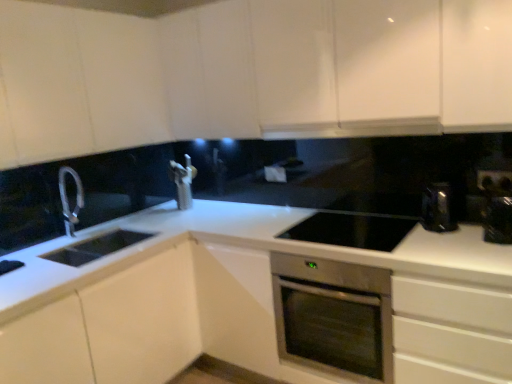
Question: From the image's perspective, does stainless steel oven at center appear lower than white glossy cabinet at upper left, arranged as the second cabinetry when ordered from the bottom?

Choices:
 (A) yes
 (B) no

Answer: (A)

Question: Can you confirm if stainless steel oven at center is positioned to the left of white glossy cabinet at upper left, arranged as the second cabinetry when ordered from the bottom?

Choices:
 (A) yes
 (B) no

Answer: (B)

Question: Does stainless steel oven at center have a greater height compared to white glossy cabinet at upper left, arranged as the second cabinetry when ordered from the bottom?

Choices:
 (A) no
 (B) yes

Answer: (A)

Question: Is stainless steel oven at center not within white glossy cabinet at upper left, arranged as the second cabinetry when ordered from the bottom?

Choices:
 (A) yes
 (B) no

Answer: (A)

Question: Is stainless steel oven at center placed right next to white glossy cabinet at upper left, arranged as the second cabinetry when ordered from the bottom?

Choices:
 (A) yes
 (B) no

Answer: (B)

Question: In terms of width, does stainless steel oven at center look wider or thinner when compared to white glossy cabinet at upper left, arranged as the second cabinetry when ordered from the bottom?

Choices:
 (A) wide
 (B) thin

Answer: (A)

Question: In the image, is stainless steel oven at center positioned in front of or behind white glossy cabinet at upper left, the 2th cabinetry in the top-to-bottom sequence?

Choices:
 (A) front
 (B) behind

Answer: (B)

Question: Is stainless steel oven at center taller or shorter than white glossy cabinet at upper left, arranged as the second cabinetry when ordered from the bottom?

Choices:
 (A) short
 (B) tall

Answer: (A)

Question: Choose the correct answer: Is stainless steel oven at center inside white glossy cabinet at upper left, arranged as the second cabinetry when ordered from the bottom, or outside it?

Choices:
 (A) outside
 (B) inside

Answer: (A)

Question: In the image, is metallic silver toaster at right, the second appliance viewed from the left, on the left side or the right side of white glossy cabinet at upper center, positioned as the 1th cabinetry in top-to-bottom order?

Choices:
 (A) right
 (B) left

Answer: (A)

Question: Is metallic silver toaster at right, the second appliance viewed from the left, in front of or behind white glossy cabinet at upper center, which is the third cabinetry from bottom to top, in the image?

Choices:
 (A) front
 (B) behind

Answer: (B)

Question: Choose the correct answer: Is metallic silver toaster at right, the second appliance viewed from the left, inside white glossy cabinet at upper center, positioned as the 1th cabinetry in top-to-bottom order, or outside it?

Choices:
 (A) outside
 (B) inside

Answer: (A)

Question: Considering the positions of point (506, 238) and point (291, 49), is point (506, 238) closer or farther from the camera than point (291, 49)?

Choices:
 (A) closer
 (B) farther

Answer: (A)

Question: From a real-world perspective, relative to white glossy exhaust hood at upper center, is white glossy countertop at center vertically above or below?

Choices:
 (A) above
 (B) below

Answer: (B)

Question: From the image's perspective, is white glossy countertop at center above or below white glossy exhaust hood at upper center?

Choices:
 (A) above
 (B) below

Answer: (B)